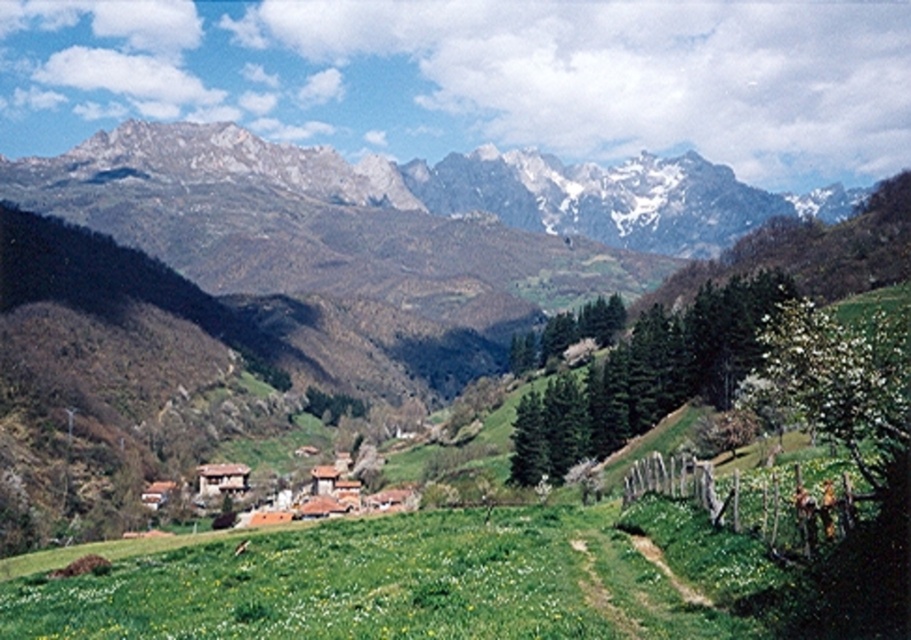
Question: Is rugged stone mountain range at upper center to the left of brown clay houses at center from the viewer's perspective?

Choices:
 (A) no
 (B) yes

Answer: (A)

Question: Can you confirm if rugged stone mountain range at upper center is wider than brown clay houses at center?

Choices:
 (A) no
 (B) yes

Answer: (B)

Question: Among these points, which one is farthest from the camera?

Choices:
 (A) (543, 168)
 (B) (352, 483)

Answer: (A)

Question: In this image, where is rugged stone mountain range at upper center located relative to brown clay houses at center?

Choices:
 (A) below
 (B) above

Answer: (B)

Question: Which point is closer to the camera?

Choices:
 (A) brown clay houses at center
 (B) rugged stone mountain range at upper center

Answer: (A)